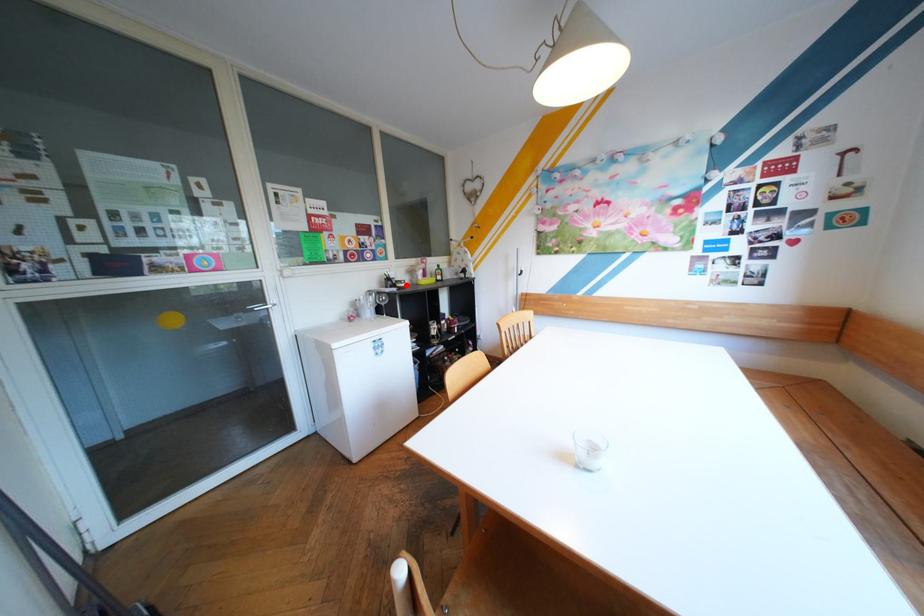
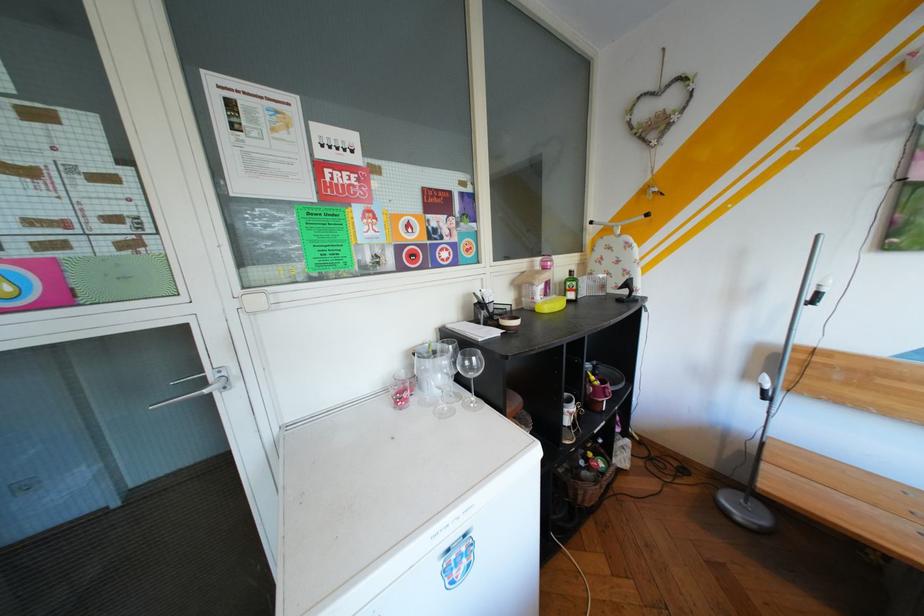
Where in the second image is the point corresponding to the highlighted location from the first image?

(505, 320)